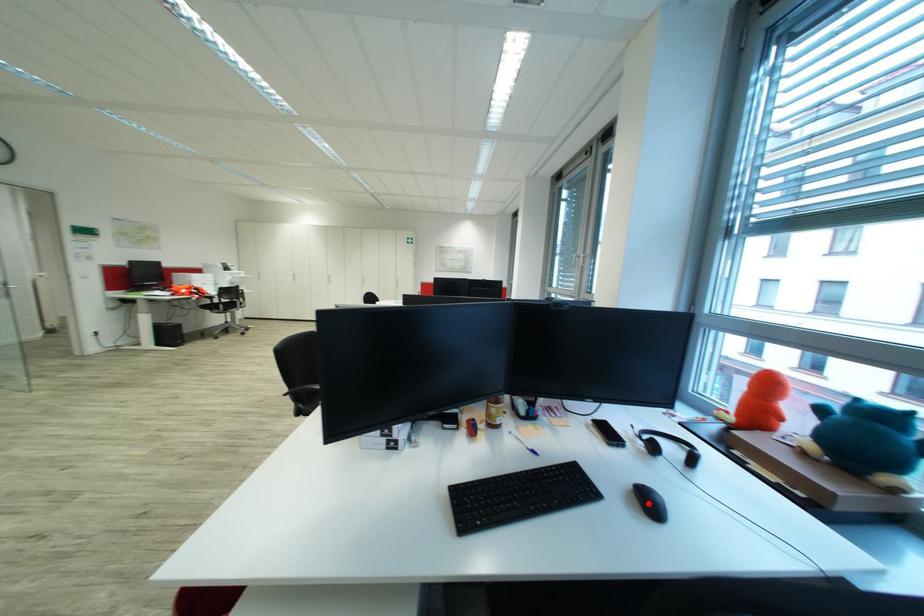
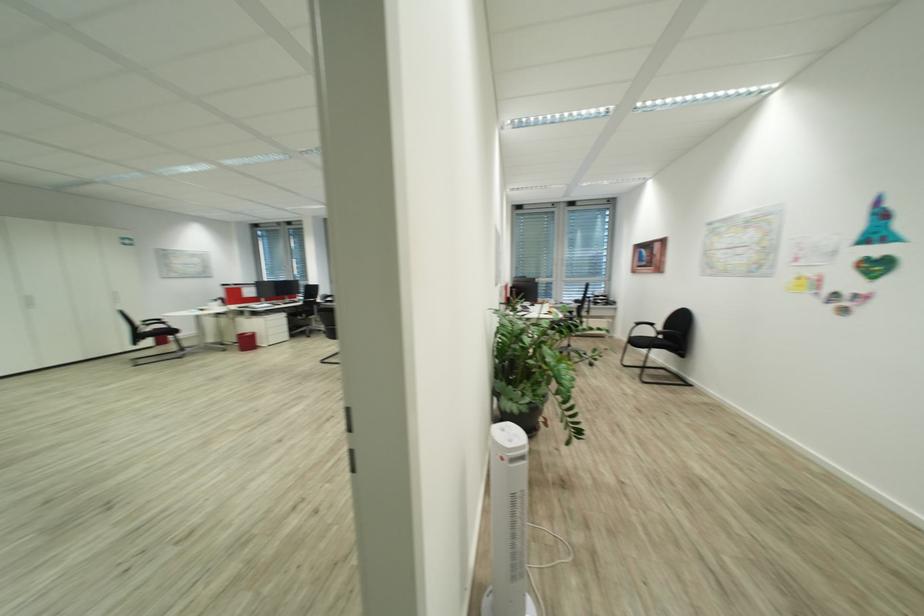
Question: I am providing you with two images of the same scene from different viewpoints. A red point is marked on the first image. At the location where the point appears in image 1, is it still visible in image 2?

Choices:
 (A) Yes
 (B) No

Answer: (B)